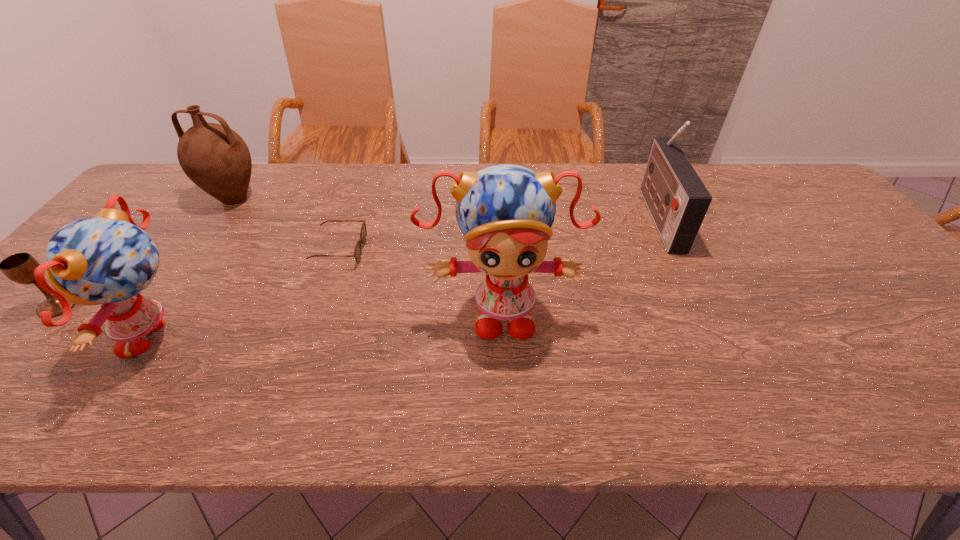
I want to click on the second closest object to the pitcher, so click(x=108, y=259).